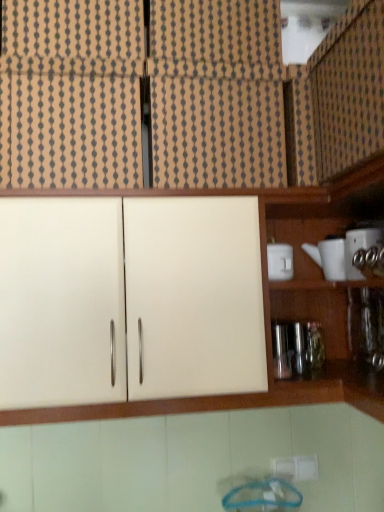
Question: Considering the relative sizes of white glossy cup at upper right, the third appliance in the right-to-left sequence, and white ceramic teapot at right, which is the second appliance in left-to-right order, in the image provided, is white glossy cup at upper right, the third appliance in the right-to-left sequence, bigger than white ceramic teapot at right, which is the second appliance in left-to-right order,?

Choices:
 (A) no
 (B) yes

Answer: (A)

Question: From the image's perspective, would you say white glossy cup at upper right, the third appliance in the right-to-left sequence, is positioned over white ceramic teapot at right, which is the second appliance in left-to-right order?

Choices:
 (A) no
 (B) yes

Answer: (A)

Question: Is white glossy cup at upper right, arranged as the 1th appliance when viewed from the left, positioned with its back to white ceramic teapot at right, which ranks as the second appliance in right-to-left order?

Choices:
 (A) yes
 (B) no

Answer: (B)

Question: Is white glossy cup at upper right, the third appliance in the right-to-left sequence, not near white ceramic teapot at right, which is the second appliance in left-to-right order?

Choices:
 (A) no
 (B) yes

Answer: (A)

Question: Can you confirm if white glossy cup at upper right, the third appliance in the right-to-left sequence, is taller than white ceramic teapot at right, which is the second appliance in left-to-right order?

Choices:
 (A) no
 (B) yes

Answer: (A)

Question: Is white glossy cup at upper right, arranged as the 1th appliance when viewed from the left, directly adjacent to white ceramic teapot at right, which is the second appliance in left-to-right order?

Choices:
 (A) no
 (B) yes

Answer: (A)

Question: Is white ceramic teapot at right, which is the second appliance in left-to-right order, oriented towards metallic silver bottle at right?

Choices:
 (A) yes
 (B) no

Answer: (B)

Question: Can you confirm if white ceramic teapot at right, which ranks as the second appliance in right-to-left order, is wider than metallic silver bottle at right?

Choices:
 (A) no
 (B) yes

Answer: (B)

Question: Does white ceramic teapot at right, which is the second appliance in left-to-right order, have a lesser width compared to metallic silver bottle at right?

Choices:
 (A) no
 (B) yes

Answer: (A)

Question: Can you confirm if white ceramic teapot at right, which is the second appliance in left-to-right order, is shorter than metallic silver bottle at right?

Choices:
 (A) yes
 (B) no

Answer: (A)

Question: Is white ceramic teapot at right, which ranks as the second appliance in right-to-left order, positioned behind metallic silver bottle at right?

Choices:
 (A) yes
 (B) no

Answer: (A)

Question: From the image's perspective, does white ceramic teapot at right, which ranks as the second appliance in right-to-left order, appear higher than metallic silver bottle at right?

Choices:
 (A) no
 (B) yes

Answer: (B)

Question: Does white matte cabinet at upper left, which is the third cabinetry in top-to-bottom order, have a smaller size compared to white glossy teapot at right, the 3th appliance in the left-to-right sequence?

Choices:
 (A) no
 (B) yes

Answer: (A)